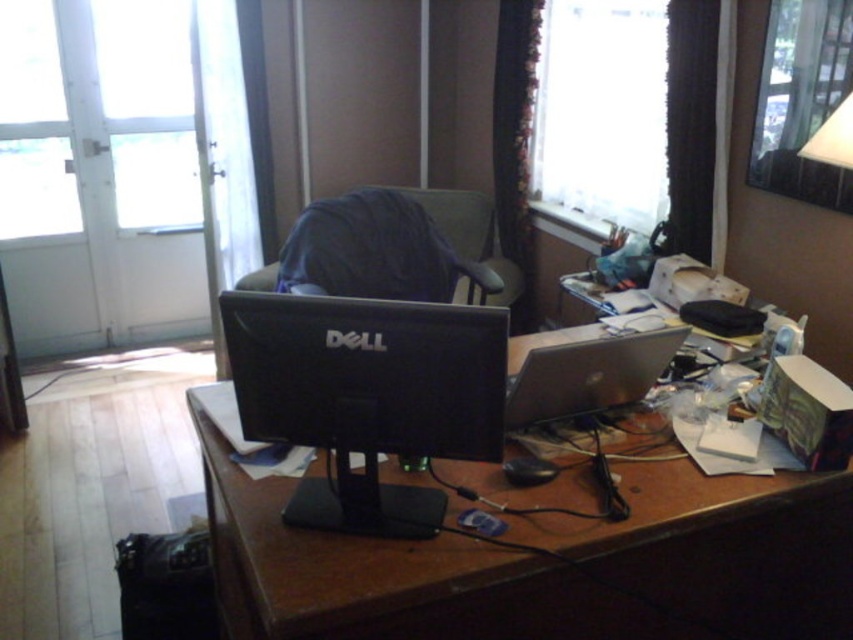
Does brown wooden desk at center have a smaller size compared to dark blue fabric swivel chair at center?

No, brown wooden desk at center is not smaller than dark blue fabric swivel chair at center.

Describe the element at coordinates (486, 493) in the screenshot. I see `brown wooden desk at center` at that location.

I want to click on brown wooden desk at center, so click(x=486, y=493).

Is brown wooden desk at center thinner than silver metallic laptop at center?

Incorrect, brown wooden desk at center's width is not less than silver metallic laptop at center's.

Which of these two, brown wooden desk at center or silver metallic laptop at center, stands taller?

Standing taller between the two is brown wooden desk at center.

The width and height of the screenshot is (853, 640). Find the location of `brown wooden desk at center`. brown wooden desk at center is located at coordinates (486, 493).

Where is `brown wooden desk at center`? Image resolution: width=853 pixels, height=640 pixels. brown wooden desk at center is located at coordinates [486, 493].

Who is lower down, black glossy monitor at center or dark blue fabric swivel chair at center?

black glossy monitor at center is below.

Does point (453, 320) lie behind point (440, 204)?

No.

Which is behind, point (422, 397) or point (380, 209)?

The point (380, 209) is more distant.

The width and height of the screenshot is (853, 640). I want to click on black glossy monitor at center, so pyautogui.click(x=367, y=396).